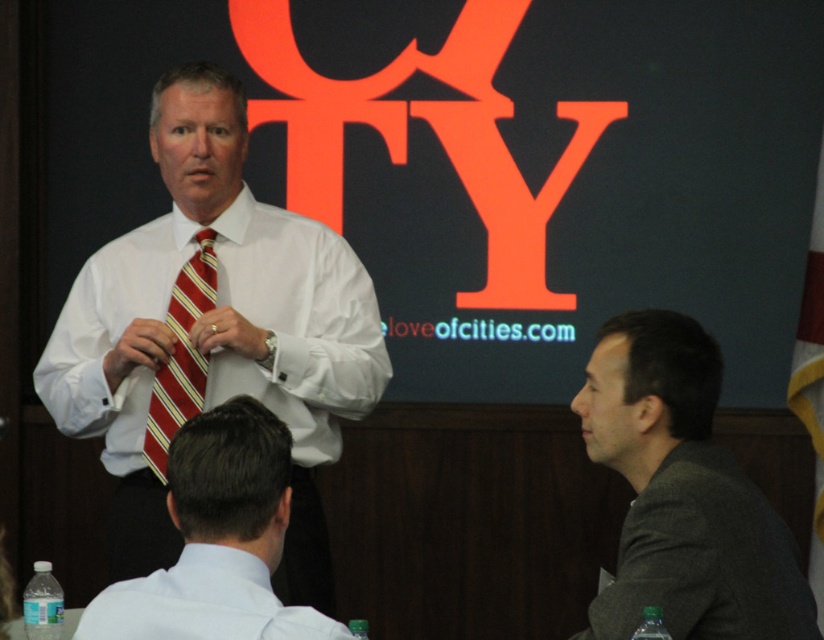
Which of these two, matte orange projection screen at upper center or dark gray suit at right, stands shorter?

Standing shorter between the two is dark gray suit at right.

Between point (542, 3) and point (584, 419), which one is positioned in front?

Point (584, 419) is in front.

This screenshot has height=640, width=824. Find the location of `matte orange projection screen at upper center`. matte orange projection screen at upper center is located at coordinates (478, 164).

Does white smooth shirt at lower left have a smaller size compared to red striped tie at center?

Yes.

How far apart are white smooth shirt at lower left and red striped tie at center?

white smooth shirt at lower left and red striped tie at center are 1.11 meters apart.

I want to click on white smooth shirt at lower left, so click(x=204, y=604).

Where is `white smooth shirt at lower left`? This screenshot has height=640, width=824. white smooth shirt at lower left is located at coordinates coord(204,604).

Which is more to the right, dark gray suit at right or white smooth shirt at lower left?

Positioned to the right is dark gray suit at right.

Measure the distance between point [701,369] and camera.

A distance of 7.53 feet exists between point [701,369] and camera.

Which is behind, point (649, 362) or point (179, 634)?

The point (649, 362) is behind.

Image resolution: width=824 pixels, height=640 pixels. I want to click on dark gray suit at right, so click(x=682, y=493).